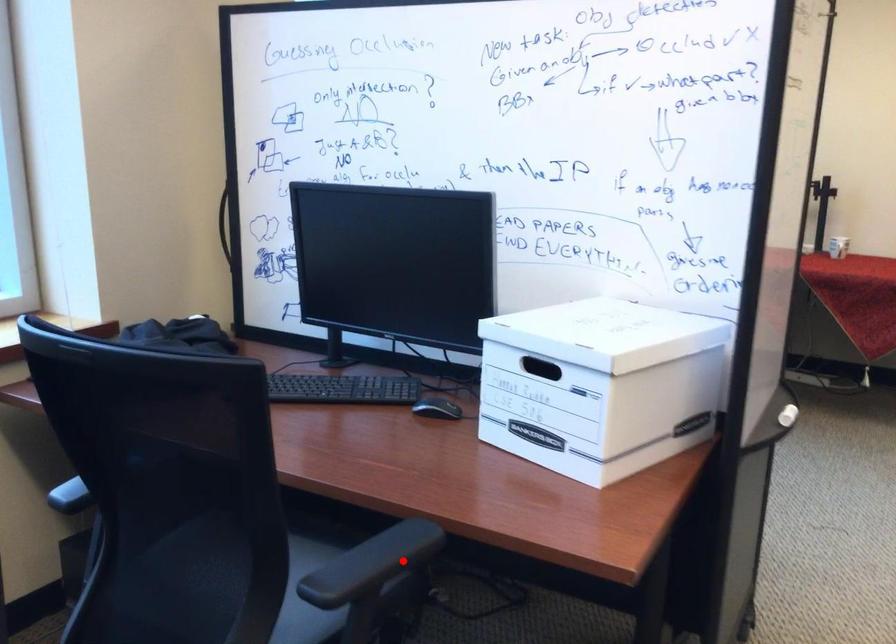
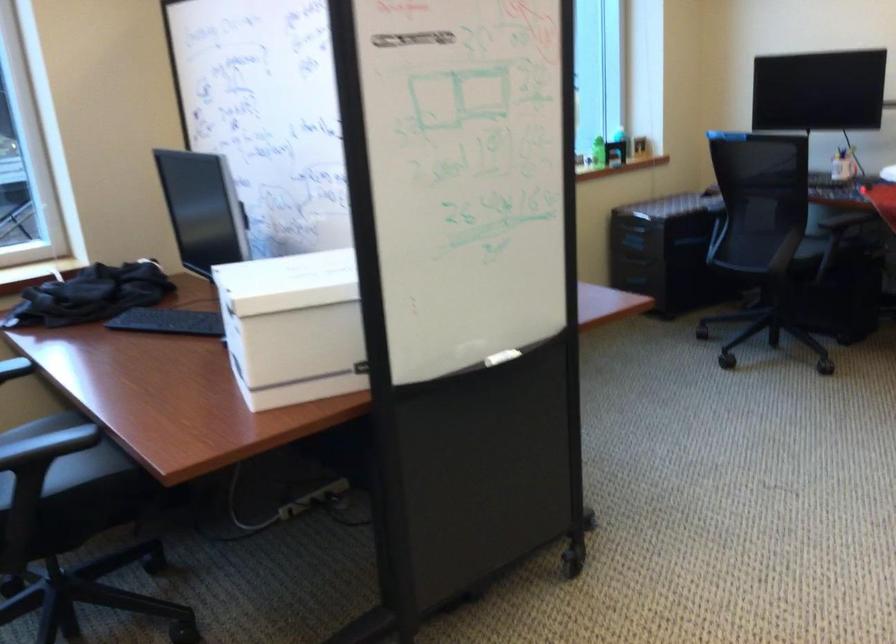
Question: I am providing you with two images of the same scene from different viewpoints. Given a red point in image1, look at the same physical point in image2. Is it:

Choices:
 (A) Closer to the viewpoint
 (B) Farther from the viewpoint

Answer: (B)